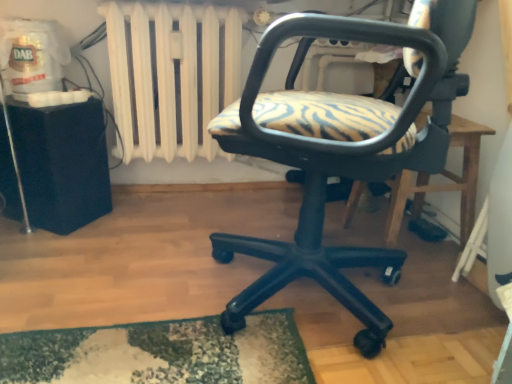
Question: Considering the relative sizes of matte black office chair at center and wooden table at center, arranged as the 2th table when viewed from the left, in the image provided, is matte black office chair at center shorter than wooden table at center, arranged as the 2th table when viewed from the left,?

Choices:
 (A) yes
 (B) no

Answer: (B)

Question: Is matte black office chair at center oriented away from wooden table at center, arranged as the 2th table when viewed from the left?

Choices:
 (A) yes
 (B) no

Answer: (B)

Question: Is matte black office chair at center at the left side of wooden table at center, which appears as the first table when viewed from the right?

Choices:
 (A) no
 (B) yes

Answer: (B)

Question: Is matte black office chair at center behind wooden table at center, arranged as the 2th table when viewed from the left?

Choices:
 (A) yes
 (B) no

Answer: (B)

Question: From the image's perspective, would you say matte black office chair at center is positioned over wooden table at center, arranged as the 2th table when viewed from the left?

Choices:
 (A) no
 (B) yes

Answer: (B)

Question: Would you say white painted metal radiator at upper center is inside or outside black plastic table at left, marked as the 1th table in a left-to-right arrangement?

Choices:
 (A) outside
 (B) inside

Answer: (A)

Question: In terms of width, does white painted metal radiator at upper center look wider or thinner when compared to black plastic table at left, marked as the 1th table in a left-to-right arrangement?

Choices:
 (A) wide
 (B) thin

Answer: (B)

Question: Considering the positions of white painted metal radiator at upper center and black plastic table at left, marked as the 1th table in a left-to-right arrangement, in the image, is white painted metal radiator at upper center bigger or smaller than black plastic table at left, marked as the 1th table in a left-to-right arrangement,?

Choices:
 (A) big
 (B) small

Answer: (A)

Question: From a real-world perspective, is white painted metal radiator at upper center physically located above or below black plastic table at left, the 2th table viewed from the right?

Choices:
 (A) above
 (B) below

Answer: (A)

Question: Would you say matte black office chair at center is inside or outside white painted metal radiator at upper center?

Choices:
 (A) outside
 (B) inside

Answer: (A)

Question: Looking at the image, does matte black office chair at center seem bigger or smaller compared to white painted metal radiator at upper center?

Choices:
 (A) big
 (B) small

Answer: (A)

Question: Considering the positions of point (387, 158) and point (117, 39), is point (387, 158) closer or farther from the camera than point (117, 39)?

Choices:
 (A) closer
 (B) farther

Answer: (A)

Question: From the image's perspective, relative to white painted metal radiator at upper center, is matte black office chair at center above or below?

Choices:
 (A) below
 (B) above

Answer: (A)

Question: Is black plastic table at left, marked as the 1th table in a left-to-right arrangement, bigger or smaller than matte black office chair at center?

Choices:
 (A) big
 (B) small

Answer: (B)

Question: Is black plastic table at left, the 2th table viewed from the right, spatially inside matte black office chair at center, or outside of it?

Choices:
 (A) inside
 (B) outside

Answer: (B)